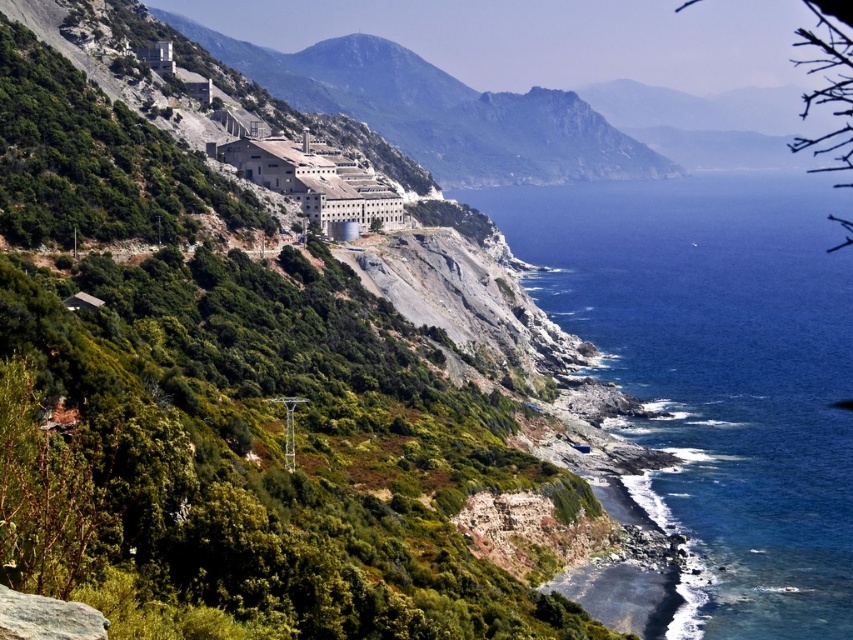
You are a delivery drone that needs to fly from the rugged stone mountain at upper center to the blue water at lower right. The drone has a maximum flight range of 100 meters. Can it make the trip without needing to recharge?

The distance between the rugged stone mountain at upper center and the blue water at lower right is 109.12 meters, which exceeds the drone s 100 meter range. Therefore, the drone cannot complete the trip without recharging.

You are standing on the cliff and looking out towards the rugged stone mountain at upper center and the blue water at lower right. Which object is nearer to you?

The blue water at lower right is closer to the viewer than the rugged stone mountain at upper center.